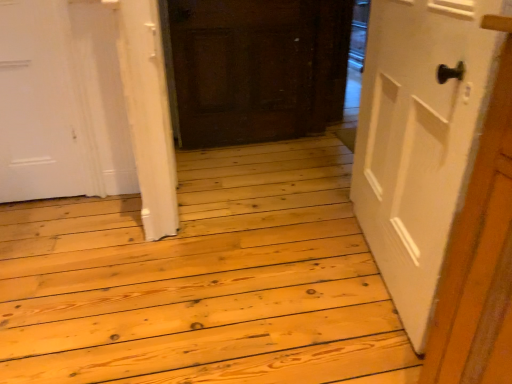
Find the location of a particular element. vacant space in front of white matte door at right, the second door from the back is located at coordinates (347, 331).